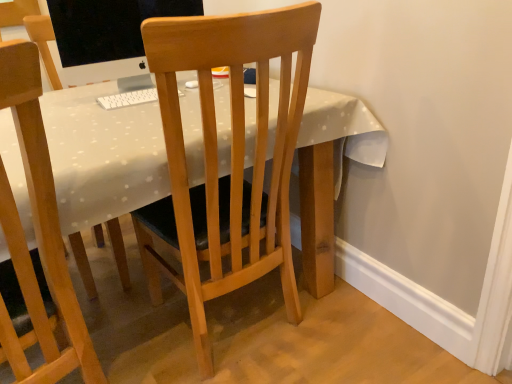
Question: Could you tell me if wooden chair at center, the 2th chair viewed from the right, is facing wooden desk at center?

Choices:
 (A) no
 (B) yes

Answer: (B)

Question: Is wooden chair at center, placed as the first chair when sorted from left to right, to the right of wooden desk at center from the viewer's perspective?

Choices:
 (A) yes
 (B) no

Answer: (B)

Question: Is wooden chair at center, placed as the first chair when sorted from left to right, at the left side of wooden desk at center?

Choices:
 (A) yes
 (B) no

Answer: (A)

Question: Is wooden chair at center, the 2th chair viewed from the right, touching wooden desk at center?

Choices:
 (A) no
 (B) yes

Answer: (A)

Question: Is wooden chair at center, the 2th chair viewed from the right, surrounding wooden desk at center?

Choices:
 (A) yes
 (B) no

Answer: (B)

Question: Considering the relative sizes of wooden chair at center, the 2th chair viewed from the right, and wooden desk at center in the image provided, is wooden chair at center, the 2th chair viewed from the right, taller than wooden desk at center?

Choices:
 (A) no
 (B) yes

Answer: (B)

Question: Could wooden desk at center be considered to be inside matte black monitor at upper left?

Choices:
 (A) no
 (B) yes

Answer: (A)

Question: Is matte black monitor at upper left aimed at wooden desk at center?

Choices:
 (A) yes
 (B) no

Answer: (B)

Question: From a real-world perspective, does matte black monitor at upper left sit lower than wooden desk at center?

Choices:
 (A) yes
 (B) no

Answer: (B)

Question: Is matte black monitor at upper left directly adjacent to wooden desk at center?

Choices:
 (A) no
 (B) yes

Answer: (A)

Question: From a real-world perspective, is matte black monitor at upper left over wooden desk at center?

Choices:
 (A) yes
 (B) no

Answer: (A)

Question: Is matte black monitor at upper left positioned with its back to wooden desk at center?

Choices:
 (A) yes
 (B) no

Answer: (B)

Question: Does light wood chair at center, which appears as the second chair when viewed from the left, have a larger size compared to wooden desk at center?

Choices:
 (A) yes
 (B) no

Answer: (B)